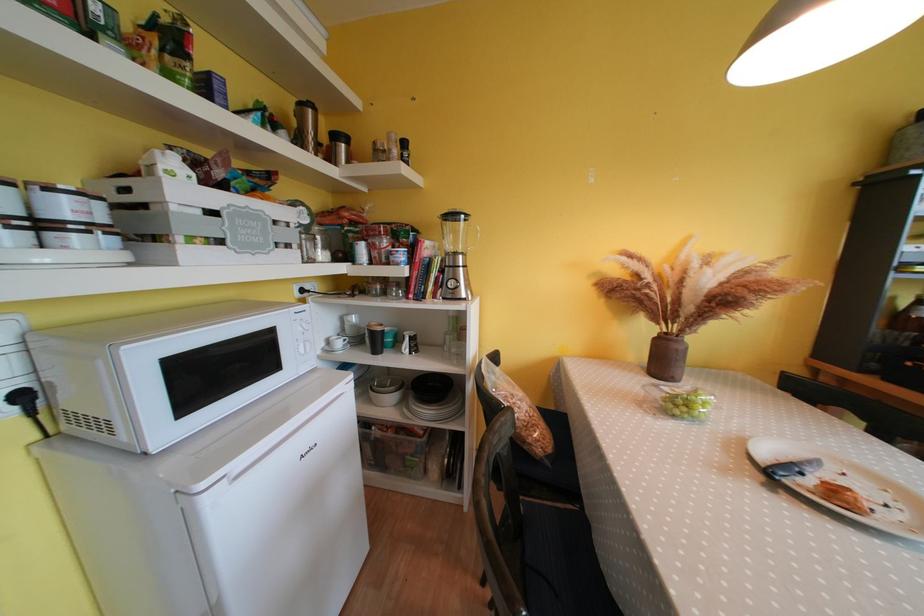
Find where to lift the black bowl. Please return your answer as a coordinate pair (x, y).

(431, 387)